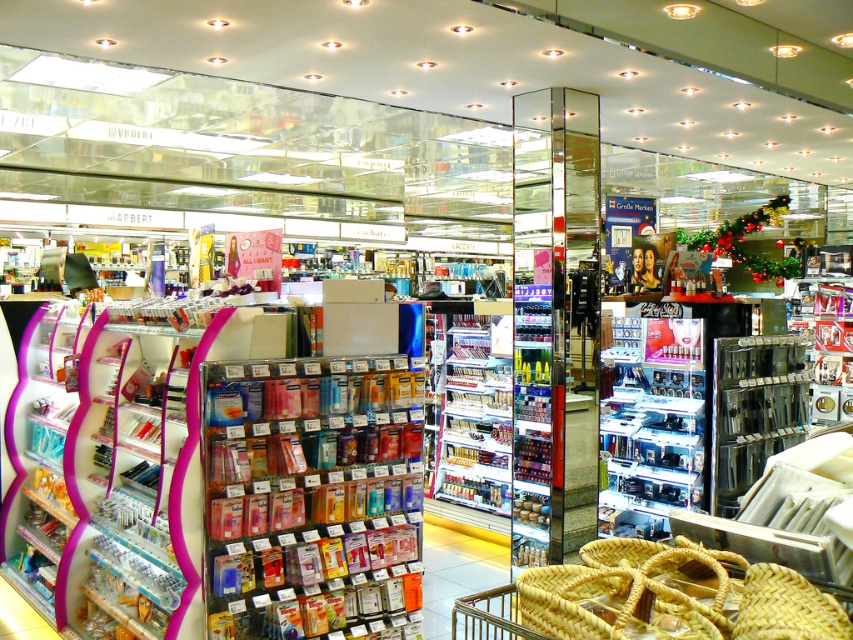
Question: Is metallic silver lipsticks at center wider than shiny plastic lipstick at center?

Choices:
 (A) yes
 (B) no

Answer: (A)

Question: Which point is farther to the camera?

Choices:
 (A) (451, 330)
 (B) (639, 499)

Answer: (A)

Question: Based on their relative distances, which object is nearer to the clear plastic packaging at center?

Choices:
 (A) metallic silver lipsticks at center
 (B) shiny plastic lipstick at center

Answer: (A)

Question: Observing the image, what is the correct spatial positioning of metallic silver lipsticks at center in reference to shiny plastic lipstick at center?

Choices:
 (A) right
 (B) left

Answer: (A)

Question: Can you confirm if clear plastic packaging at center is positioned above shiny plastic lipstick at center?

Choices:
 (A) no
 (B) yes

Answer: (A)

Question: Which object appears closest to the camera in this image?

Choices:
 (A) metallic silver lipsticks at center
 (B) shiny plastic lipstick at center

Answer: (A)